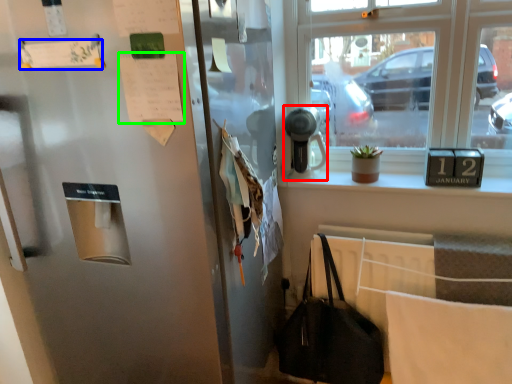
Question: Estimate the real-world distances between objects in this image. Which object is farther from appliance (highlighted by a red box), paper (highlighted by a blue box) or paper (highlighted by a green box)?

Choices:
 (A) paper
 (B) paper

Answer: (A)